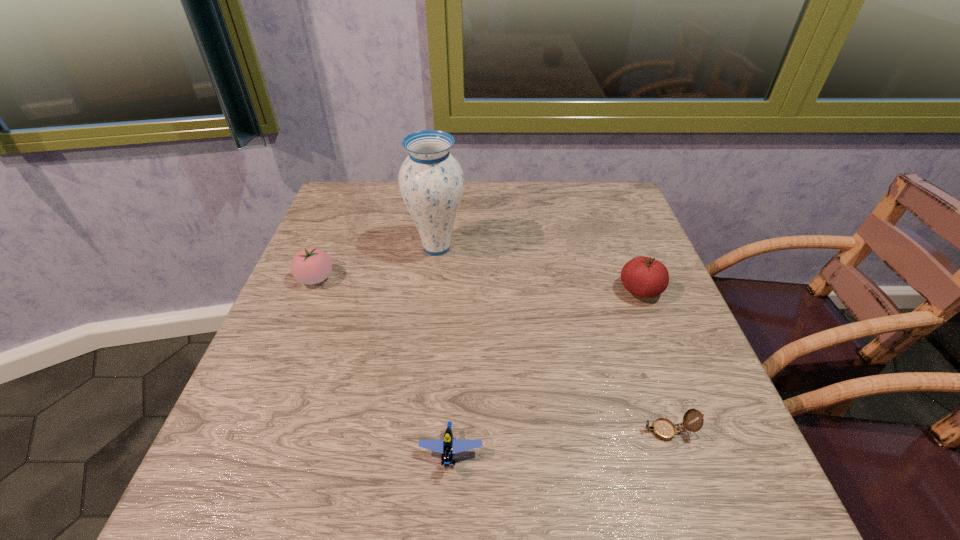
Locate an element on the screen. free location at the right edge is located at coordinates (628, 375).

In the image, there is a desktop. Where is `vacant space at the far left corner`? The width and height of the screenshot is (960, 540). vacant space at the far left corner is located at coordinates (367, 200).

You are a GUI agent. You are given a task and a screenshot of the screen. Output one action in this format:
    pyautogui.click(x=<x>, y=<y>)
    Task: Click on the vacant space at the far right corner
    This screenshot has width=960, height=540.
    Given the screenshot: What is the action you would take?
    pyautogui.click(x=610, y=186)

The height and width of the screenshot is (540, 960). Find the location of `free space that is in between the leftmost object and the taller tomato`. free space that is in between the leftmost object and the taller tomato is located at coordinates (478, 284).

Locate an element on the screen. vacant space in between the shorter tomato and the tallest object is located at coordinates (376, 263).

At what (x,y) coordinates should I click in order to perform the action: click on free space between the fourth tallest object and the shortest object. Please return your answer as a coordinate pair (x, y). Image resolution: width=960 pixels, height=540 pixels. Looking at the image, I should click on (560, 442).

Where is `empty space that is in between the shortest object and the vase`? The width and height of the screenshot is (960, 540). empty space that is in between the shortest object and the vase is located at coordinates (552, 339).

Where is `blank region between the Lego and the second tallest object`? The image size is (960, 540). blank region between the Lego and the second tallest object is located at coordinates (545, 372).

Identify the location of vacant area that lies between the fourth shortest object and the shortest object. This screenshot has width=960, height=540. (654, 361).

Identify the location of vacant space that's between the shortest object and the taller tomato. (654, 361).